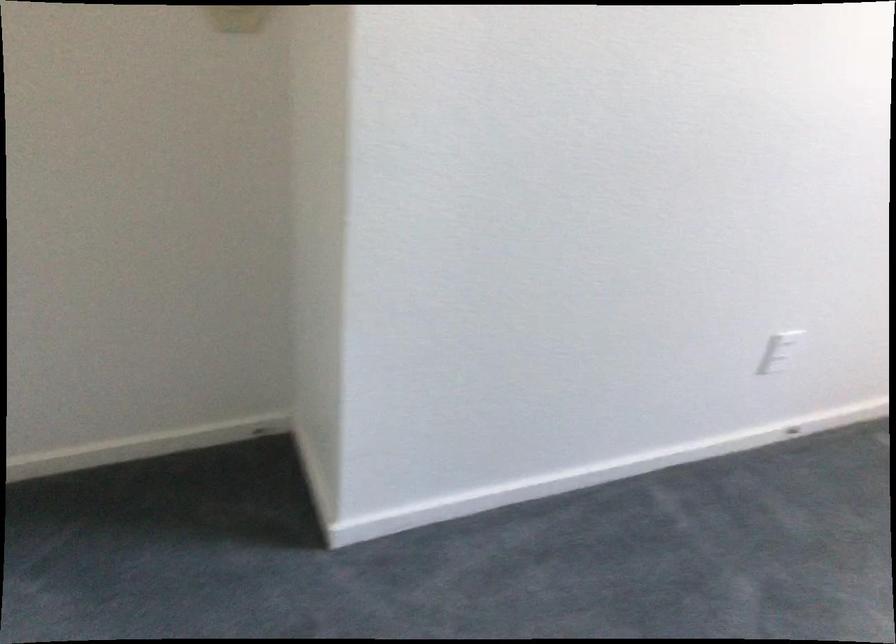
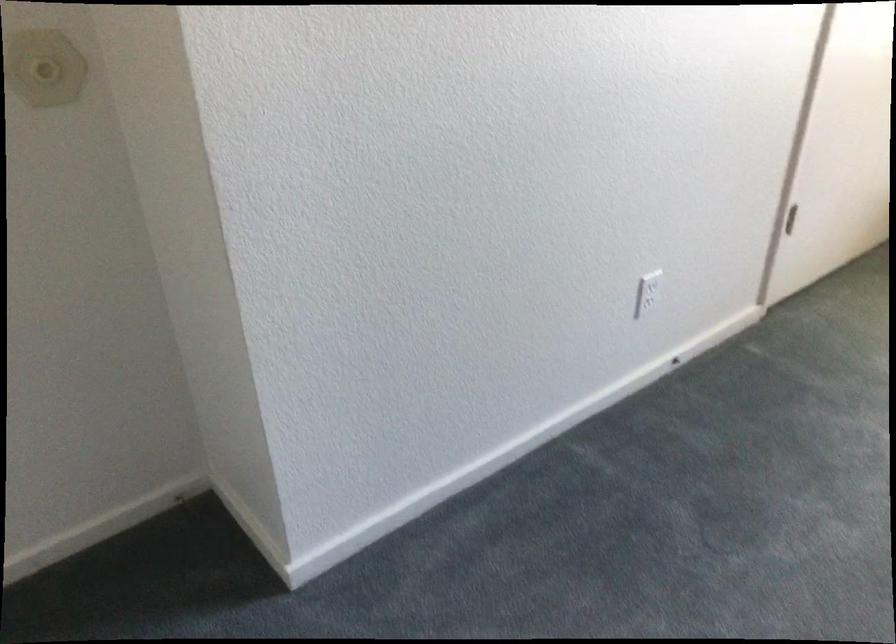
Where in the second image is the point corresponding to [770,365] from the first image?

(645, 303)